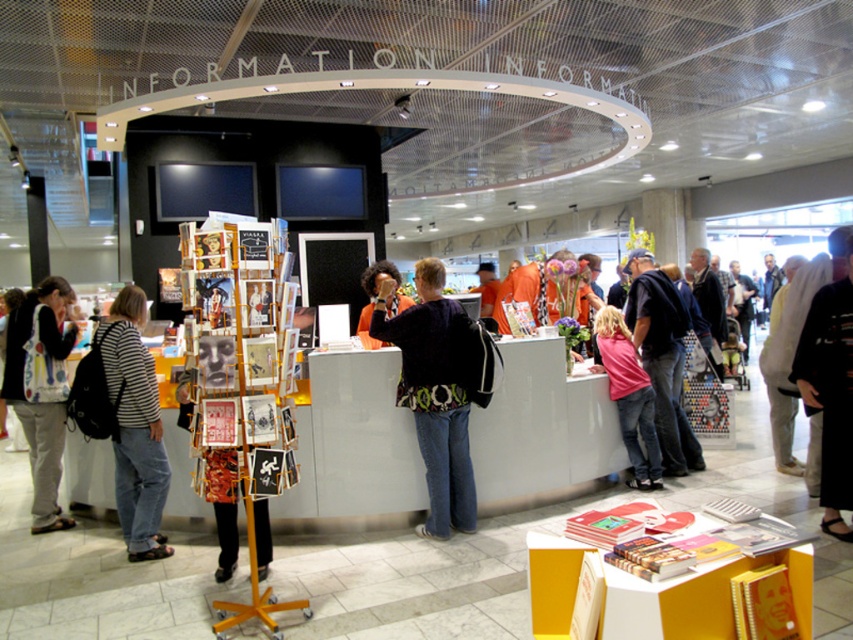
Based on the photo, can you confirm if dark blue jeans at center is thinner than orange fabric shirt at center?

No.

Does point (654, 358) come farther from viewer compared to point (392, 304)?

Yes, it is behind point (392, 304).

In order to click on dark blue jeans at center in this screenshot , I will do `click(660, 356)`.

Is printed fabric bag at left further to the viewer compared to dark blue jeans at center?

That is False.

How distant is printed fabric bag at left from dark blue jeans at center?

printed fabric bag at left and dark blue jeans at center are 14.11 feet apart from each other.

Is point (39, 509) positioned before point (634, 275)?

Yes, point (39, 509) is closer to viewer.

Where is `printed fabric bag at left`? This screenshot has height=640, width=853. printed fabric bag at left is located at coordinates (39, 401).

How far apart are dark blue sweater at center and black kimono at center?

dark blue sweater at center and black kimono at center are 1.98 meters apart.

What do you see at coordinates (434, 392) in the screenshot?
I see `dark blue sweater at center` at bounding box center [434, 392].

The width and height of the screenshot is (853, 640). What are the coordinates of `dark blue sweater at center` in the screenshot? It's located at (434, 392).